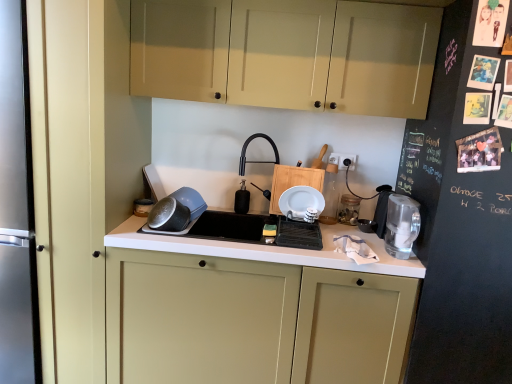
Question: From the image's perspective, is translucent glass jar at upper right, placed as the second appliance when sorted from right to left, located above or below white plastic electric outlet at upper right?

Choices:
 (A) below
 (B) above

Answer: (A)

Question: In terms of size, does translucent glass jar at upper right, placed as the second appliance when sorted from right to left, appear bigger or smaller than white plastic electric outlet at upper right?

Choices:
 (A) small
 (B) big

Answer: (B)

Question: Which of these objects is positioned closest to the matte cream cabinet at center, positioned as the second cabinetry in top-to-bottom order?

Choices:
 (A) matte plastic bowl at center
 (B) black matte faucet at center
 (C) matte black container at left, the fourth appliance when ordered from right to left
 (D) translucent glass jar at upper right, positioned as the third appliance in left-to-right order
 (E) black matte soap dispenser at center, which is the 3th appliance from right to left

Answer: (A)

Question: Which object is positioned closest to the matte cream cabinet at center, the first cabinetry from the bottom?

Choices:
 (A) black chalkboard at right
 (B) matte cream cabinets at upper center, placed as the 2th cabinetry when sorted from bottom to top
 (C) matte black container at left, the fourth appliance when ordered from right to left
 (D) black matte soap dispenser at center, which is the 3th appliance from right to left
 (E) translucent glass jar at upper right, placed as the second appliance when sorted from right to left

Answer: (A)